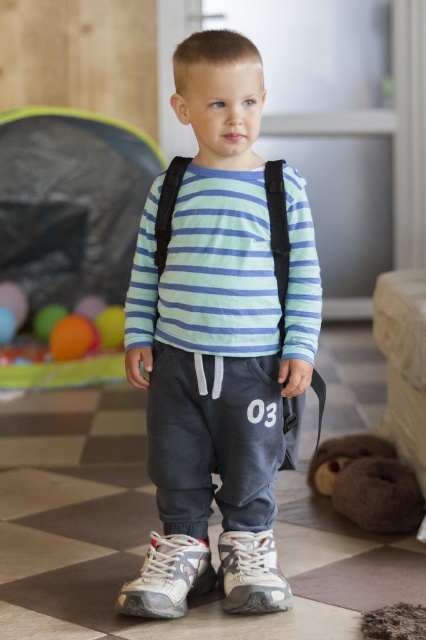
Question: Which point is farther from the camera taking this photo?

Choices:
 (A) (245, 392)
 (B) (321, 460)

Answer: (B)

Question: Which object is closer to the camera taking this photo?

Choices:
 (A) matte gray sweatpants at center
 (B) striped cotton shirt at center

Answer: (A)

Question: Which point is farther to the camera?

Choices:
 (A) brown plush toy at lower right
 (B) white mesh shoe at lower center

Answer: (A)

Question: Is matte gray sweatpants at center smaller than matte orange ball at lower left?

Choices:
 (A) yes
 (B) no

Answer: (B)

Question: Does matte gray sweatpants at center lie behind white mesh shoe at lower center?

Choices:
 (A) no
 (B) yes

Answer: (A)

Question: Can you confirm if striped cotton shirt at center is positioned below rubberized orange ball at lower left?

Choices:
 (A) yes
 (B) no

Answer: (B)